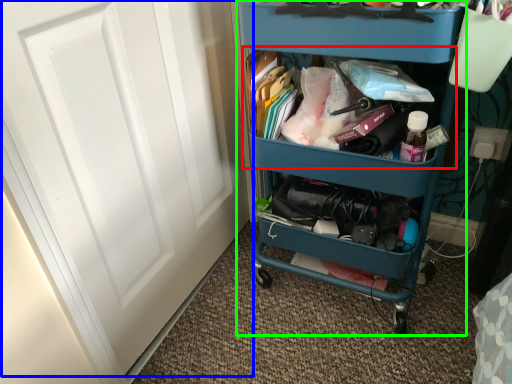
Question: Estimate the real-world distances between objects in this image. Which object is closer to cabinet (highlighted by a red box), door (highlighted by a blue box) or furniture (highlighted by a green box)?

Choices:
 (A) door
 (B) furniture

Answer: (B)